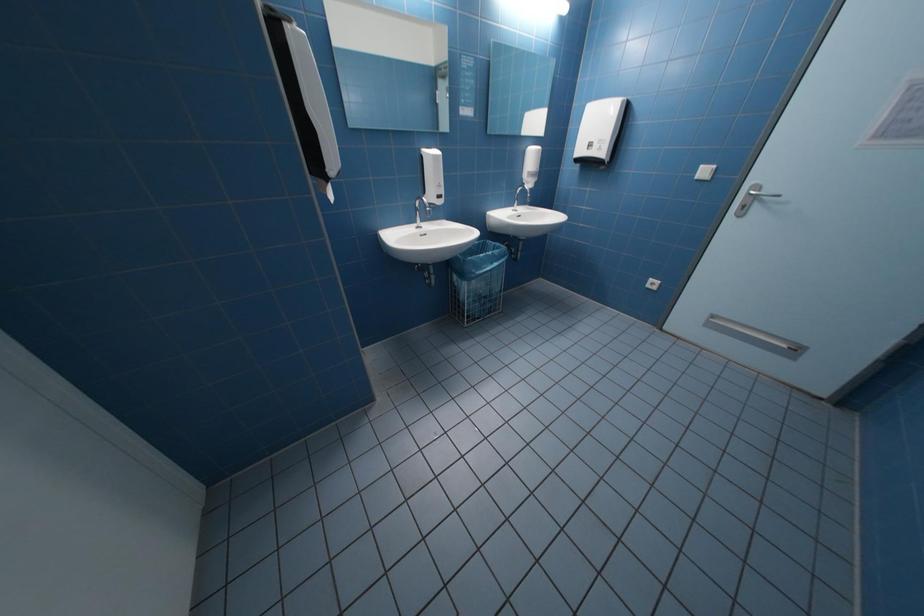
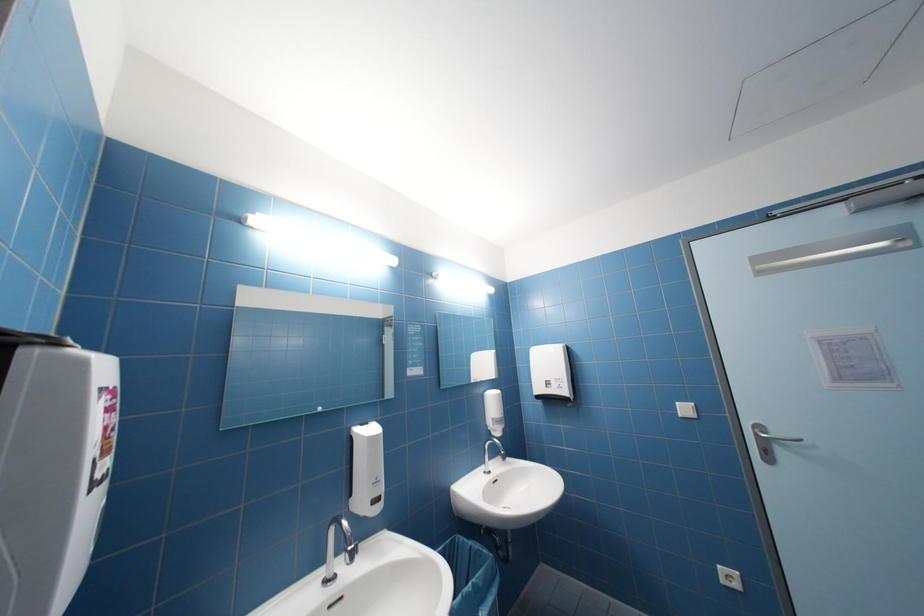
How did the camera likely rotate?

The camera rotated toward right-up.